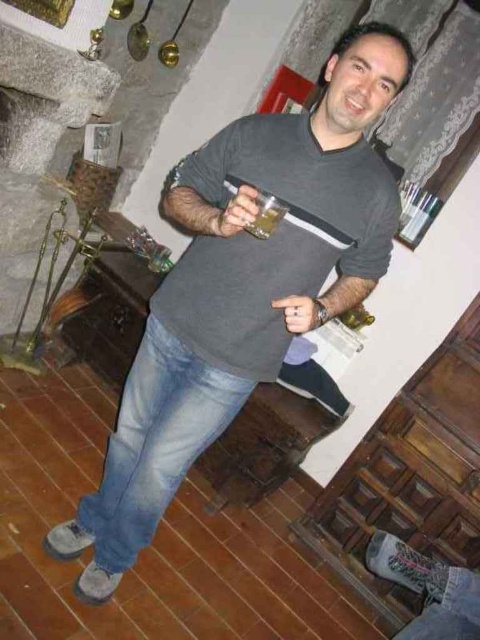
Question: Observing the image, what is the correct spatial positioning of gray matte t-shirt at center in reference to translucent glass at upper center?

Choices:
 (A) below
 (B) above

Answer: (A)

Question: Does gray matte t-shirt at center have a greater width compared to matte gray hand at center?

Choices:
 (A) no
 (B) yes

Answer: (B)

Question: Which point appears closest to the camera in this image?

Choices:
 (A) (226, 216)
 (B) (265, 237)
 (C) (375, 266)

Answer: (A)

Question: Does matte plastic cup at center appear over matte gray hand at center?

Choices:
 (A) yes
 (B) no

Answer: (A)

Question: Which of the following is the farthest from the observer?

Choices:
 (A) (284, 300)
 (B) (108, 504)

Answer: (B)

Question: Among these points, which one is farthest from the camera?

Choices:
 (A) (252, 225)
 (B) (208, 301)
 (C) (223, 230)
 (D) (292, 321)

Answer: (B)